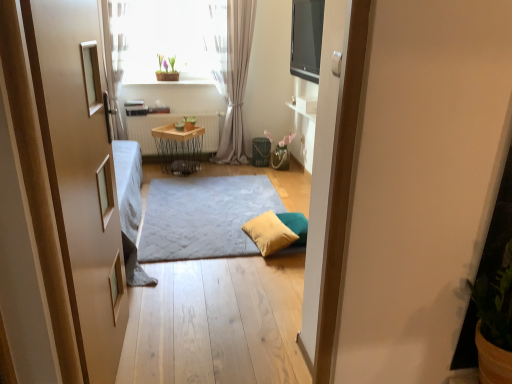
Describe the element at coordinates (178, 148) in the screenshot. This screenshot has width=512, height=384. I see `wooden/metallic table at center` at that location.

In order to face wooden/metallic table at center, should I rotate leftwards or rightwards?

Rotate your view left by about 9.996°.

This screenshot has width=512, height=384. Describe the element at coordinates (148, 129) in the screenshot. I see `wooden radiator at center` at that location.

Locate an element on the screen. Image resolution: width=512 pixels, height=384 pixels. light gray sheer curtain at center is located at coordinates (236, 80).

This screenshot has width=512, height=384. In order to click on soft gray carpet at center in this screenshot , I will do `click(204, 217)`.

The width and height of the screenshot is (512, 384). What are the coordinates of `wooden/metallic table at center` in the screenshot? It's located at (178, 148).

Is wooden radiator at center oriented towards wooden door at left?

Yes, wooden radiator at center is turned towards wooden door at left.

Find the location of a particular element. The width and height of the screenshot is (512, 384). door below the wooden radiator at center (from the image's perspective) is located at coordinates (81, 173).

Looking at the image, does wooden radiator at center seem bigger or smaller compared to wooden door at left?

Considering their sizes, wooden radiator at center takes up less space than wooden door at left.

Which point is more distant from viewer, (143, 150) or (67, 29)?

The point (143, 150) is behind.

Image resolution: width=512 pixels, height=384 pixels. Find the location of `pillow located on the right of translucent glass window at upper center`. pillow located on the right of translucent glass window at upper center is located at coordinates (276, 231).

Considering the relative positions of translucent glass window at upper center and yellow fabric pillow at center in the image provided, is translucent glass window at upper center in front of yellow fabric pillow at center?

No, translucent glass window at upper center is behind yellow fabric pillow at center.

Does translucent glass window at upper center turn towards yellow fabric pillow at center?

No, translucent glass window at upper center is not aimed at yellow fabric pillow at center.

How distant is translucent glass window at upper center from yellow fabric pillow at center?

They are 7.52 feet apart.

Can you confirm if light gray sheer curtain at center is taller than green matte pot at upper center?

Yes, light gray sheer curtain at center is taller than green matte pot at upper center.

Based on the photo, from a real-world perspective, is light gray sheer curtain at center above or below green matte pot at upper center?

light gray sheer curtain at center is below green matte pot at upper center.

The width and height of the screenshot is (512, 384). I want to click on curtain in front of the green matte pot at upper center, so click(x=236, y=80).

From the picture: Are light gray sheer curtain at center and green matte pot at upper center making contact?

light gray sheer curtain at center and green matte pot at upper center are clearly separated.

Is wooden radiator at center behind yellow fabric pillow at center?

That is True.

Can you tell me how much wooden radiator at center and yellow fabric pillow at center differ in facing direction?

There is a 83-degree angle between the facing directions of wooden radiator at center and yellow fabric pillow at center.

From a real-world perspective, between wooden radiator at center and yellow fabric pillow at center, who is vertically lower?

yellow fabric pillow at center.

Does wooden radiator at center touch yellow fabric pillow at center?

They are not placed beside each other.

Is wooden/metallic table at center positioned far away from green matte pot at upper center?

That's not correct — wooden/metallic table at center is a little close to green matte pot at upper center.

Who is smaller, wooden/metallic table at center or green matte pot at upper center?

green matte pot at upper center.

How many degrees apart are the facing directions of wooden/metallic table at center and green matte pot at upper center?

54 degrees.

Considering the relative sizes of wooden/metallic table at center and green matte pot at upper center in the image provided, is wooden/metallic table at center wider than green matte pot at upper center?

Yes, wooden/metallic table at center is wider than green matte pot at upper center.

Which is more to the right, yellow fabric pillow at center or green matte pot at upper center?

From the viewer's perspective, yellow fabric pillow at center appears more on the right side.

Between point (276, 238) and point (158, 54), which one is positioned in front?

The point (276, 238) is closer to the camera.

From a real-world perspective, does yellow fabric pillow at center sit lower than green matte pot at upper center?

Indeed, from a real-world perspective, yellow fabric pillow at center is positioned beneath green matte pot at upper center.

Is yellow fabric pillow at center outside of green matte pot at upper center?

Yes, yellow fabric pillow at center is not within green matte pot at upper center.

Considering the sizes of wooden door at left and translucent glass window at upper center in the image, is wooden door at left bigger or smaller than translucent glass window at upper center?

In the image, wooden door at left appears to be smaller than translucent glass window at upper center.

How much distance is there between wooden door at left and translucent glass window at upper center?

wooden door at left and translucent glass window at upper center are 9.50 feet apart.

At what (x,y) coordinates should I click in order to perform the action: click on door to the right of translucent glass window at upper center. Please return your answer as a coordinate pair (x, y). The image size is (512, 384). Looking at the image, I should click on (81, 173).

The image size is (512, 384). What are the coordinates of `radiator on the left of wooden door at left` in the screenshot? It's located at (148, 129).

At what (x,y) coordinates should I click in order to perform the action: click on window lying behind the yellow fabric pillow at center. Please return your answer as a coordinate pair (x, y). Looking at the image, I should click on (168, 38).

Based on their spatial positions, is green matte pot at upper center or light gray sheer curtain at center further from soft gray carpet at center?

green matte pot at upper center lies further to soft gray carpet at center than the other object.

Estimate the real-world distances between objects in this image. Which object is further from translucent glass window at upper center, light gray sheer curtain at center or yellow fabric pillow at center?

Based on the image, yellow fabric pillow at center appears to be further to translucent glass window at upper center.

When comparing their distances from wooden door at left, does light gray sheer curtain at center or soft gray carpet at center seem closer?

soft gray carpet at center is closer to wooden door at left.

When comparing their distances from wooden/metallic table at center, does translucent glass window at upper center or yellow fabric pillow at center seem further?

yellow fabric pillow at center.

Looking at the image, which one is located further to light gray sheer curtain at center, wooden door at left or translucent glass window at upper center?

wooden door at left is further to light gray sheer curtain at center.

Based on their spatial positions, is wooden door at left or light gray sheer curtain at center closer to wooden/metallic table at center?

Among the two, light gray sheer curtain at center is located nearer to wooden/metallic table at center.

Based on their spatial positions, is yellow fabric pillow at center or soft gray carpet at center closer to wooden/metallic table at center?

soft gray carpet at center is positioned closer to the anchor wooden/metallic table at center.

Estimate the real-world distances between objects in this image. Which object is further from green matte pot at upper center, wooden door at left or yellow fabric pillow at center?

wooden door at left is further to green matte pot at upper center.

This screenshot has height=384, width=512. In order to click on plant between translucent glass window at upper center and wooden radiator at center in the up-down direction in this screenshot , I will do tap(167, 63).

This screenshot has height=384, width=512. Identify the location of curtain between soft gray carpet at center and wooden/metallic table at center along the z-axis. (236, 80).

Identify the location of window between wooden door at left and wooden radiator at center along the z-axis. (168, 38).

This screenshot has width=512, height=384. I want to click on table between translucent glass window at upper center and yellow fabric pillow at center in the up-down direction, so click(x=178, y=148).